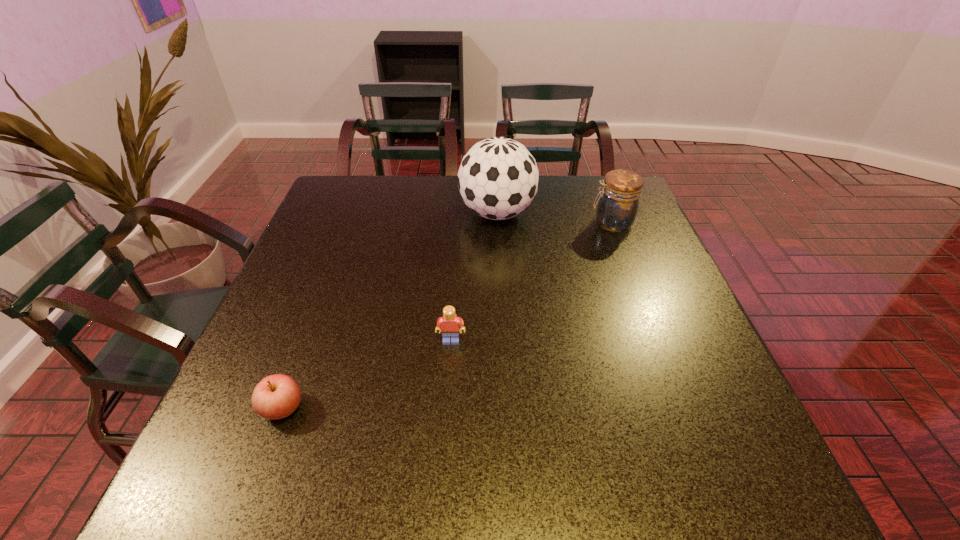
You are a GUI agent. You are given a task and a screenshot of the screen. Output one action in this format:
    pyautogui.click(x=<x>, y=<y>)
    Task: Click on the vacant space at the left edge
    This screenshot has height=540, width=960.
    Given the screenshot: What is the action you would take?
    pyautogui.click(x=351, y=247)

What are the coordinates of `vacant point at the right edge` in the screenshot? It's located at (666, 427).

In the image, there is a desktop. At what (x,y) coordinates should I click in order to perform the action: click on blank space at the near left corner. Please return your answer as a coordinate pair (x, y). Looking at the image, I should click on (278, 482).

Where is `empty space between the second nearest object and the soccer ball`? The height and width of the screenshot is (540, 960). empty space between the second nearest object and the soccer ball is located at coordinates (474, 277).

I want to click on free spot between the Lego and the nearest object, so click(367, 374).

Where is `free space that is in between the soccer ball and the second tallest object`? This screenshot has width=960, height=540. free space that is in between the soccer ball and the second tallest object is located at coordinates (555, 218).

Where is `free space between the second shortest object and the nearest object`? free space between the second shortest object and the nearest object is located at coordinates (367, 374).

Find the location of a particular element. This screenshot has width=960, height=540. vacant space that's between the third tallest object and the tallest object is located at coordinates (474, 277).

At what (x,y) coordinates should I click in order to perform the action: click on unoccupied position between the second shortest object and the apple. Please return your answer as a coordinate pair (x, y). The image size is (960, 540). Looking at the image, I should click on (367, 374).

At what (x,y) coordinates should I click in order to perform the action: click on vacant region between the second shortest object and the rightmost object. Please return your answer as a coordinate pair (x, y). The image size is (960, 540). Looking at the image, I should click on (532, 282).